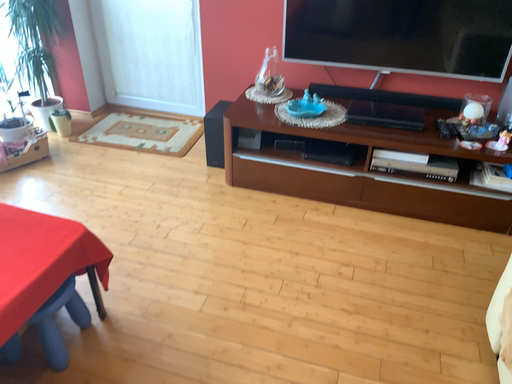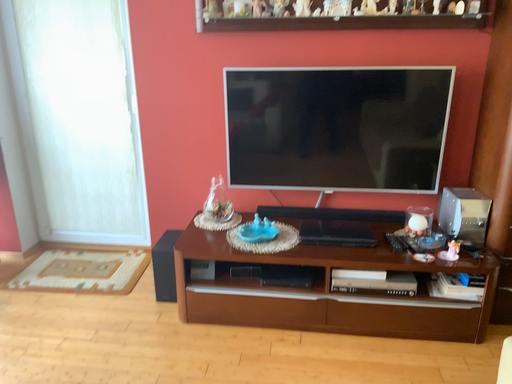
Question: How did the camera likely rotate when shooting the video?

Choices:
 (A) rotated downward
 (B) rotated upward

Answer: (B)